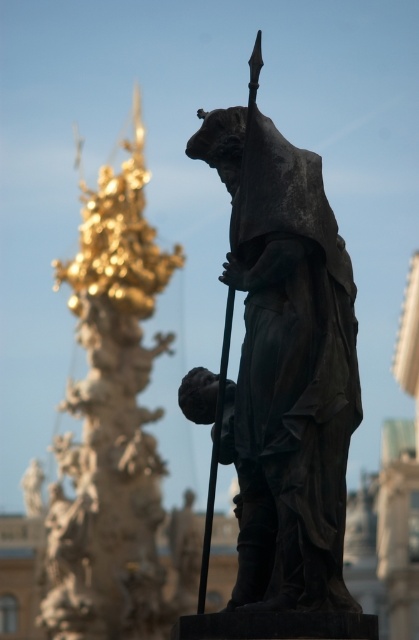
You are standing in front of a historical monument and see the bronze statue at center and the gold polished column at left. Which object is positioned to the right of the other?

The bronze statue at center is positioned to the right of the gold polished column at left.